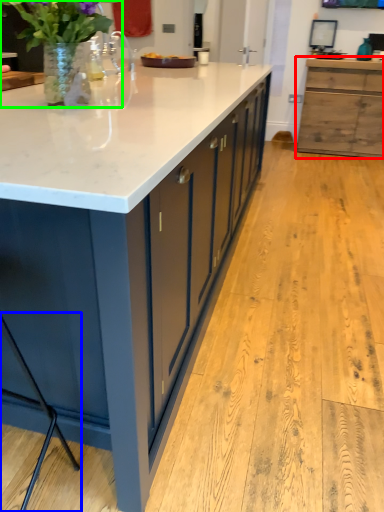
Question: Estimate the real-world distances between objects in this image. Which object is farther from cabinetry (highlighted by a red box), bar stool (highlighted by a blue box) or houseplant (highlighted by a green box)?

Choices:
 (A) bar stool
 (B) houseplant

Answer: (A)